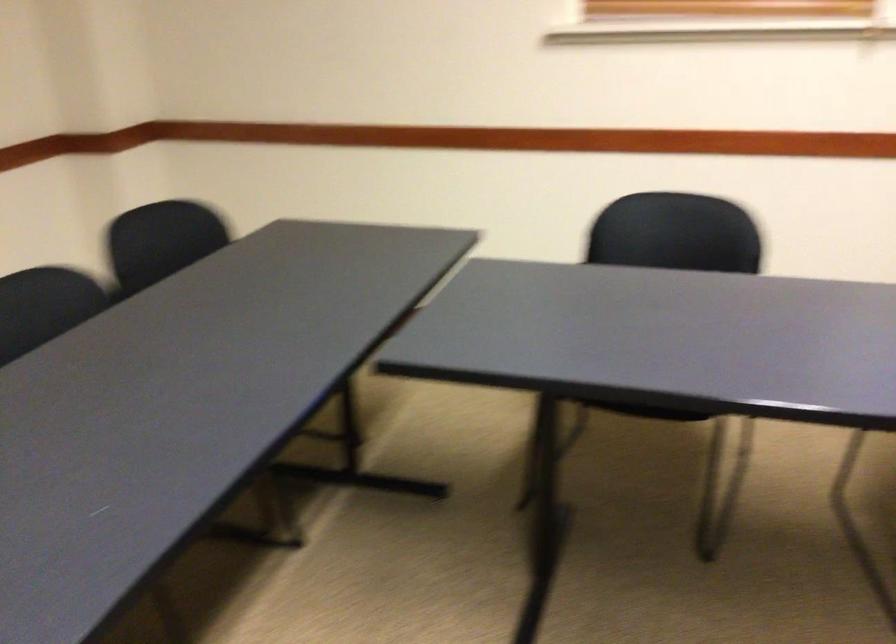
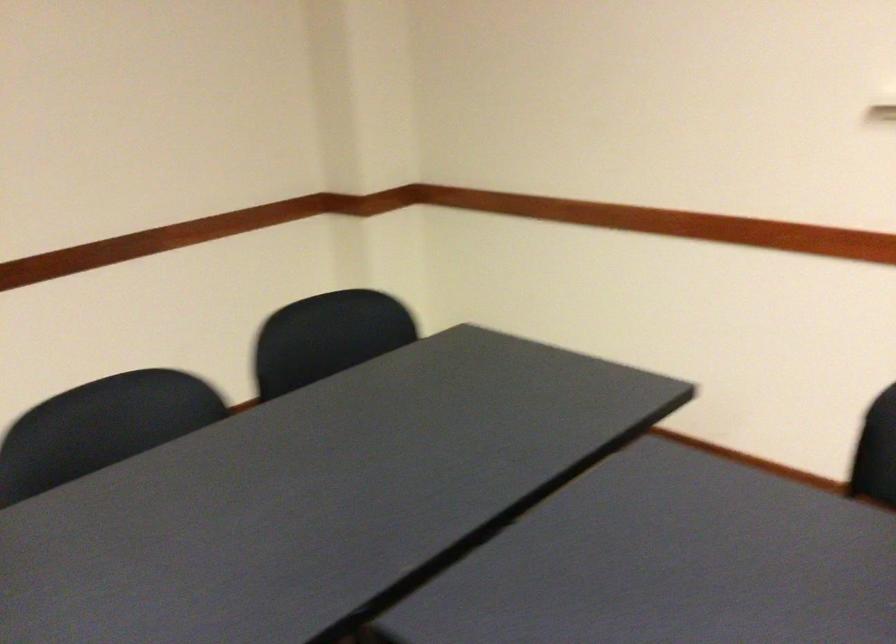
Question: How did the camera likely rotate?

Choices:
 (A) Left
 (B) Right
 (C) Up
 (D) Down

Answer: (A)